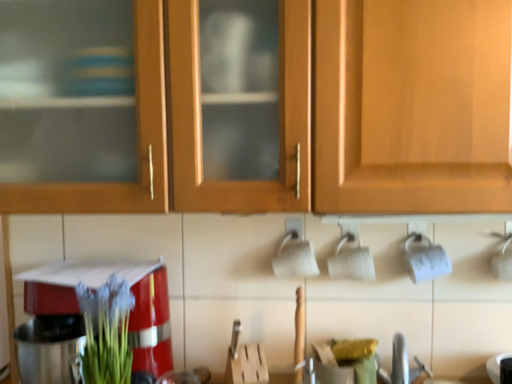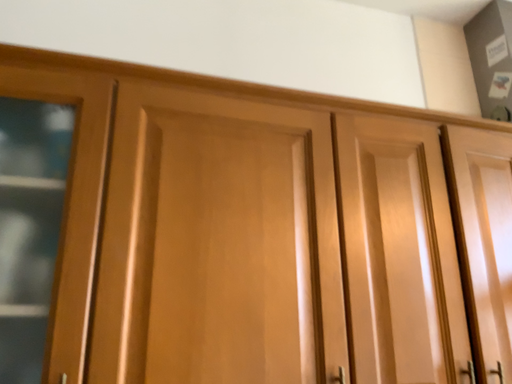
Question: How did the camera likely rotate when shooting the video?

Choices:
 (A) rotated upward
 (B) rotated downward

Answer: (A)